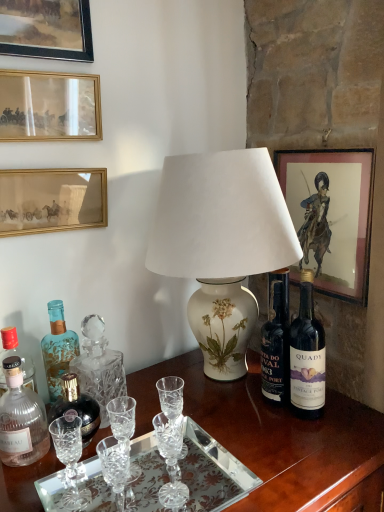
Where is `free space in front of matte glass bottle at center-left, placed as the 2th bottle when sorted from front to back`? Image resolution: width=384 pixels, height=512 pixels. free space in front of matte glass bottle at center-left, placed as the 2th bottle when sorted from front to back is located at coordinates (54, 488).